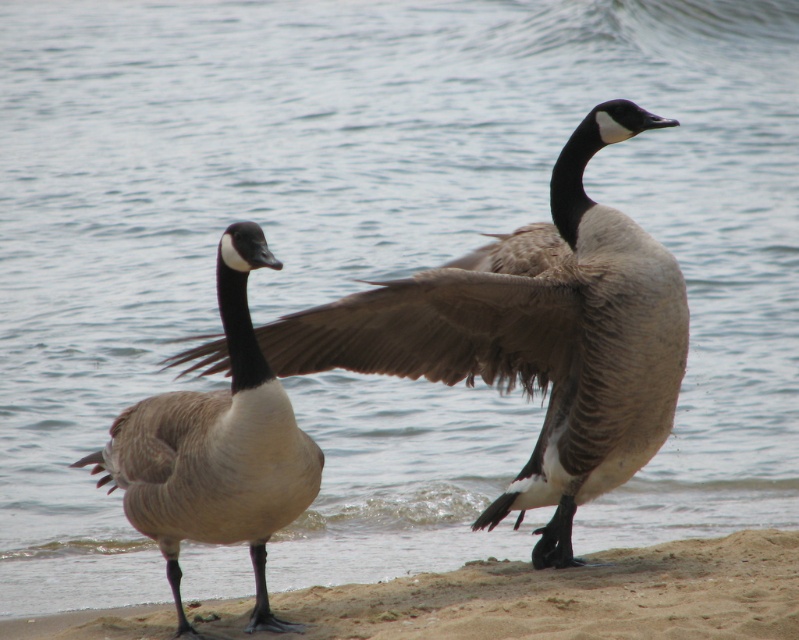
Question: Among these objects, which one is farthest from the camera?

Choices:
 (A) matte brown duck at left
 (B) brown feathered goose at center

Answer: (B)

Question: Does brown feathered goose at center have a smaller size compared to matte brown duck at left?

Choices:
 (A) yes
 (B) no

Answer: (B)

Question: Which of the following is the farthest from the observer?

Choices:
 (A) (626, 440)
 (B) (476, 612)
 (C) (253, 616)

Answer: (A)

Question: Which object is closer to the camera taking this photo?

Choices:
 (A) matte brown duck at left
 (B) sandy brown at lower center
 (C) brown feathered goose at center

Answer: (A)

Question: Is brown feathered goose at center wider than matte brown duck at left?

Choices:
 (A) no
 (B) yes

Answer: (B)

Question: Can you confirm if brown feathered goose at center is bigger than matte brown duck at left?

Choices:
 (A) no
 (B) yes

Answer: (B)